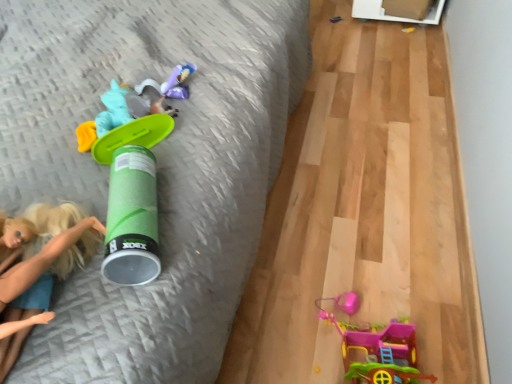
The width and height of the screenshot is (512, 384). Identify the location of vacant area that lies in front of metallic silver toy at upper right, acting as the 5th toy starting from the left. (347, 35).